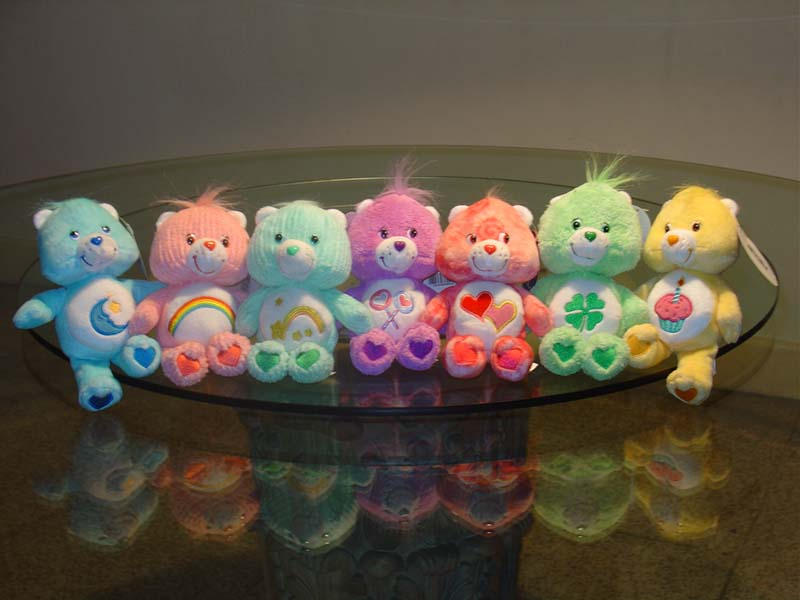
Where is `glass table top`? glass table top is located at coordinates click(x=452, y=492).